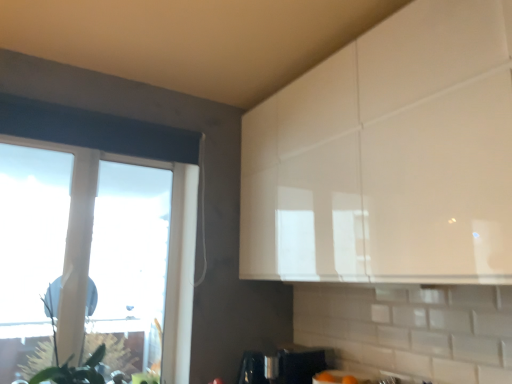
Question: Is green matte plant at left at the right side of transparent glass window at left?

Choices:
 (A) yes
 (B) no

Answer: (A)

Question: Would you say green matte plant at left is outside transparent glass window at left?

Choices:
 (A) no
 (B) yes

Answer: (B)

Question: Is transparent glass window at left a part of green matte plant at left?

Choices:
 (A) no
 (B) yes

Answer: (A)

Question: Is green matte plant at left shorter than transparent glass window at left?

Choices:
 (A) yes
 (B) no

Answer: (A)

Question: Considering the relative positions of green matte plant at left and transparent glass window at left in the image provided, is green matte plant at left behind transparent glass window at left?

Choices:
 (A) yes
 (B) no

Answer: (B)

Question: From the image's perspective, is green matte plant at left on transparent glass window at left?

Choices:
 (A) yes
 (B) no

Answer: (B)

Question: Is transparent glass window at left at the right side of satin silver coffee maker at lower center?

Choices:
 (A) yes
 (B) no

Answer: (B)

Question: Is the position of transparent glass window at left more distant than that of satin silver coffee maker at lower center?

Choices:
 (A) yes
 (B) no

Answer: (B)

Question: From the image's perspective, is transparent glass window at left over satin silver coffee maker at lower center?

Choices:
 (A) no
 (B) yes

Answer: (B)

Question: Is transparent glass window at left aimed at satin silver coffee maker at lower center?

Choices:
 (A) yes
 (B) no

Answer: (B)

Question: Considering the relative positions of transparent glass window at left and satin silver coffee maker at lower center in the image provided, is transparent glass window at left to the left of satin silver coffee maker at lower center from the viewer's perspective?

Choices:
 (A) no
 (B) yes

Answer: (B)

Question: Would you say transparent glass window at left is outside satin silver coffee maker at lower center?

Choices:
 (A) yes
 (B) no

Answer: (A)

Question: Considering the relative sizes of satin silver coffee maker at lower center and transparent glass window at left in the image provided, is satin silver coffee maker at lower center wider than transparent glass window at left?

Choices:
 (A) yes
 (B) no

Answer: (A)